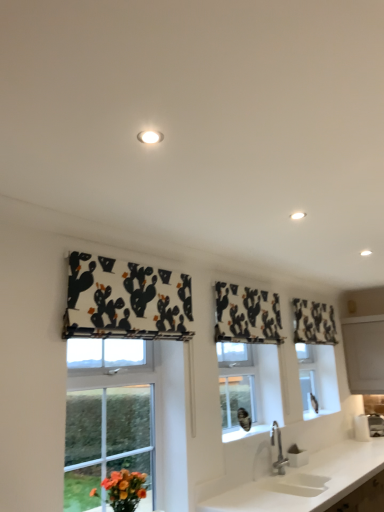
Question: Is white matte countertop at lower center bigger than black printed fabric at upper center, acting as the 1th curtain starting from the back?

Choices:
 (A) yes
 (B) no

Answer: (A)

Question: From a real-world perspective, is white matte countertop at lower center beneath black printed fabric at upper center, acting as the 1th curtain starting from the back?

Choices:
 (A) yes
 (B) no

Answer: (A)

Question: Is black printed fabric at upper center, the 1th curtain positioned from the right, surrounded by white matte countertop at lower center?

Choices:
 (A) yes
 (B) no

Answer: (B)

Question: Is white matte countertop at lower center facing towards black printed fabric at upper center, acting as the third curtain starting from the left?

Choices:
 (A) no
 (B) yes

Answer: (A)

Question: Considering the relative sizes of white matte countertop at lower center and black printed fabric at upper center, arranged as the 3th curtain when viewed from the front, in the image provided, is white matte countertop at lower center shorter than black printed fabric at upper center, arranged as the 3th curtain when viewed from the front,?

Choices:
 (A) yes
 (B) no

Answer: (B)

Question: Is white matte countertop at lower center to the left of black printed fabric at upper center, acting as the third curtain starting from the left, from the viewer's perspective?

Choices:
 (A) no
 (B) yes

Answer: (A)

Question: Does white matte countertop at lower center have a lesser width compared to black printed fabric at center, which is counted as the 2th curtain, starting from the back?

Choices:
 (A) no
 (B) yes

Answer: (A)

Question: Is white matte countertop at lower center positioned with its back to black printed fabric at center, positioned as the 2th curtain in right-to-left order?

Choices:
 (A) yes
 (B) no

Answer: (B)

Question: Is the position of white matte countertop at lower center more distant than that of black printed fabric at center, which is counted as the 2th curtain, starting from the back?

Choices:
 (A) no
 (B) yes

Answer: (A)

Question: From a real-world perspective, is white matte countertop at lower center under black printed fabric at center, which is counted as the 2th curtain, starting from the back?

Choices:
 (A) yes
 (B) no

Answer: (A)

Question: Is white matte countertop at lower center touching black printed fabric at center, which appears as the second curtain when viewed from the front?

Choices:
 (A) no
 (B) yes

Answer: (A)

Question: Is white matte countertop at lower center oriented towards black printed fabric at center, positioned as the 2th curtain in right-to-left order?

Choices:
 (A) no
 (B) yes

Answer: (A)

Question: Is black printed fabric at center, which is counted as the 2th curtain, starting from the back, turned away from white glossy light fixture at upper center?

Choices:
 (A) yes
 (B) no

Answer: (B)